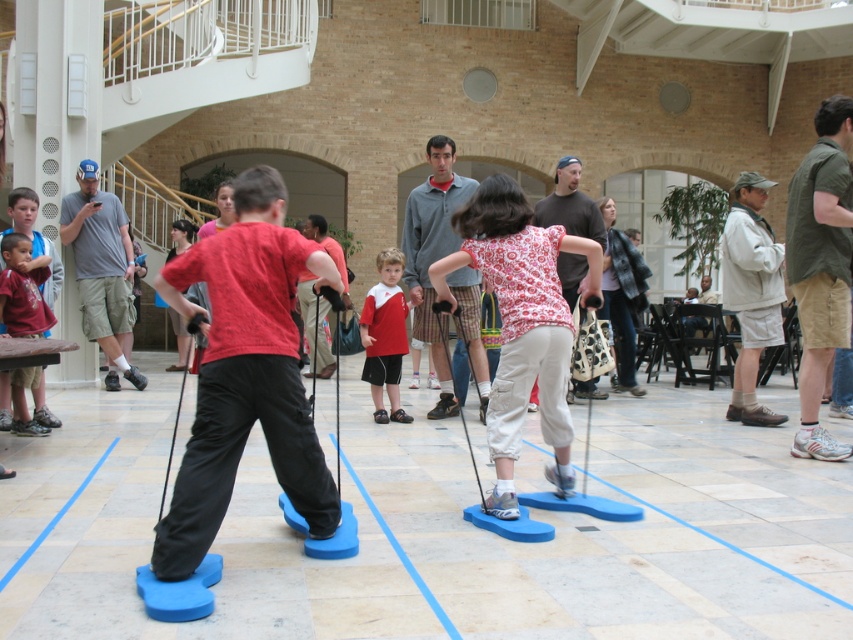
Question: Which of the following is the farthest from the observer?

Choices:
 (A) (810, 244)
 (B) (735, 228)

Answer: (B)

Question: Is floral-patterned shirt at center smaller than matte red shirt at left?

Choices:
 (A) no
 (B) yes

Answer: (A)

Question: Estimate the real-world distances between objects in this image. Which object is farther from the khaki shorts at center?

Choices:
 (A) floral-patterned shirt at center
 (B) matte red shirt at left

Answer: (B)

Question: Can you confirm if gray cotton shirt at left is positioned above red cotton shirt at center?

Choices:
 (A) yes
 (B) no

Answer: (A)

Question: Which is nearer to the floral-patterned shirt at center?

Choices:
 (A) gray cotton shirt at left
 (B) khaki shorts at center

Answer: (B)

Question: Is red cotton shirt at center positioned before matte red shirt at left?

Choices:
 (A) yes
 (B) no

Answer: (B)